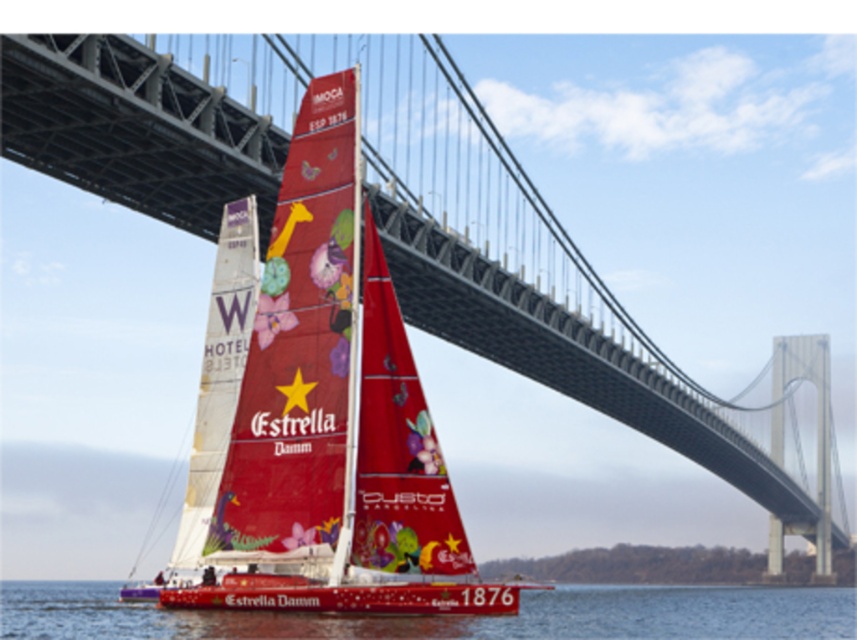
You are a photographer trying to capture the sailboat and the suspension bridge in the background. You notice the transparent water at lower center and the matte white sail at center. Which object should appear closer to you in the photo?

The transparent water at lower center appears closer to you because it is in front of the matte white sail at center in the scene.

You are a sailor on a boat that is 30 feet long. You want to dock your boat between the vivid red sailboat at center and the matte white sail at center. Is there enough space between them to dock your boat?

The distance between the vivid red sailboat at center and the matte white sail at center is 35.00 feet. Since your boat is 30 feet long, there is enough space to dock between them.

You are a photographer taking a picture of the vivid red sailboat at center and the transparent water at lower center. Which object will appear larger in the photo?

The vivid red sailboat at center will appear larger in the photo because it is closer to the viewer than the transparent water at lower center.